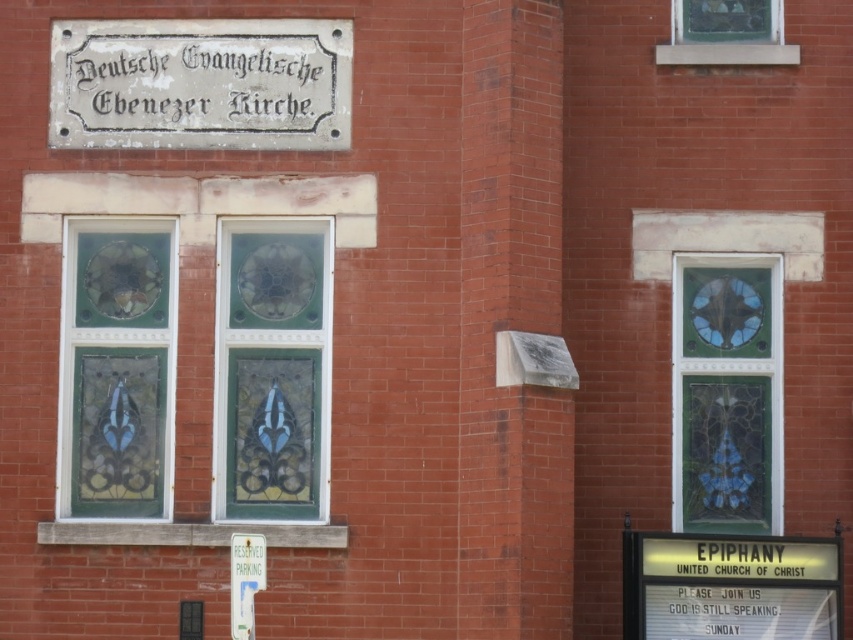
You are a visitor standing at the entrance of the Deutsche Evangelische Ebenezer Kirche. You see the white stone sign at upper center and the stained glass window at center left. Which object is positioned higher in the scene?

The white stone sign at upper center is positioned higher than the stained glass window at center left.

Consider the image. You are standing at the corner of the Deutsche Evangelische Ebenezer Kirche, looking at the building. There is a point marked at coordinates point (115, 369). What object is located at this point?

The point (115, 369) corresponds to the stained glass window at center left.

You are a visitor arriving at the Deutsche Evangelische Ebenezer Kirche. You see the white stone sign at upper center and the white plastic reserved parking sign at lower center. Which sign is taller?

The white stone sign at upper center is taller than the white plastic reserved parking sign at lower center.